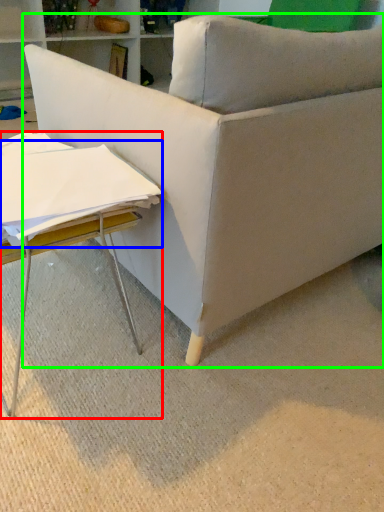
Question: Which is farther away from table (highlighted by a red box)? sheet (highlighted by a blue box) or studio couch (highlighted by a green box)?

Choices:
 (A) sheet
 (B) studio couch

Answer: (B)